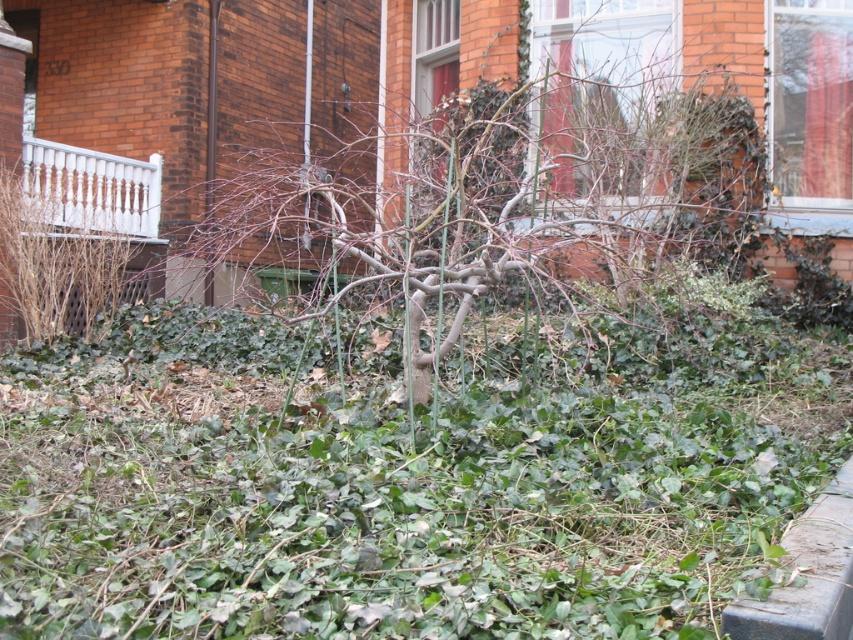
Question: Can you confirm if green leafy grass at center is bigger than bare branches at center?

Choices:
 (A) yes
 (B) no

Answer: (B)

Question: Which object is closer to the camera taking this photo?

Choices:
 (A) green leafy grass at center
 (B) bare branches at center

Answer: (A)

Question: Which object appears farthest from the camera in this image?

Choices:
 (A) bare branches at center
 (B) green leafy grass at center

Answer: (A)

Question: From the image, what is the correct spatial relationship of green leafy grass at center in relation to bare branches at center?

Choices:
 (A) right
 (B) left

Answer: (A)

Question: Does green leafy grass at center appear on the left side of bare branches at center?

Choices:
 (A) yes
 (B) no

Answer: (B)

Question: Which point is farther to the camera?

Choices:
 (A) bare branches at center
 (B) green leafy grass at center

Answer: (A)